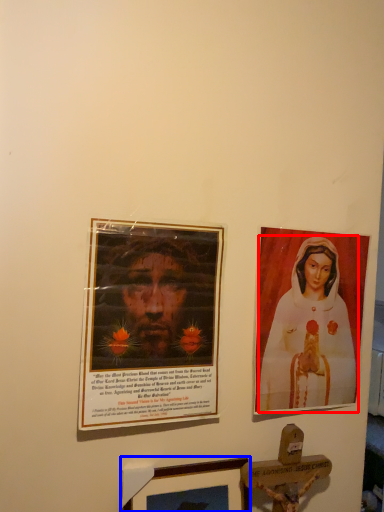
Question: Which object appears closest to the camera in this image, woman (highlighted by a red box) or picture frame (highlighted by a blue box)?

Choices:
 (A) woman
 (B) picture frame

Answer: (B)